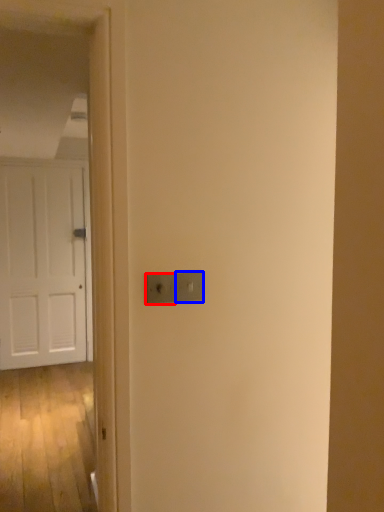
Question: Among these objects, which one is farthest to the camera, light switch (highlighted by a red box) or light switch (highlighted by a blue box)?

Choices:
 (A) light switch
 (B) light switch

Answer: (B)